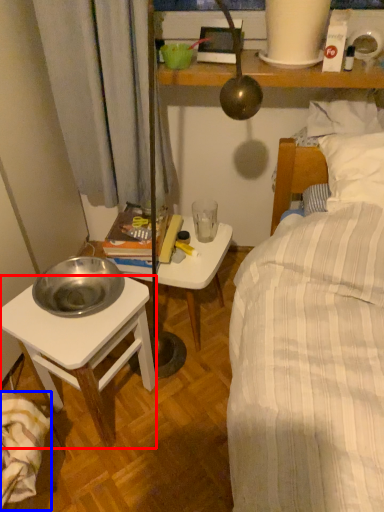
Question: Which object appears farthest to the camera in this image, desk (highlighted by a red box) or blanket (highlighted by a blue box)?

Choices:
 (A) desk
 (B) blanket

Answer: (A)